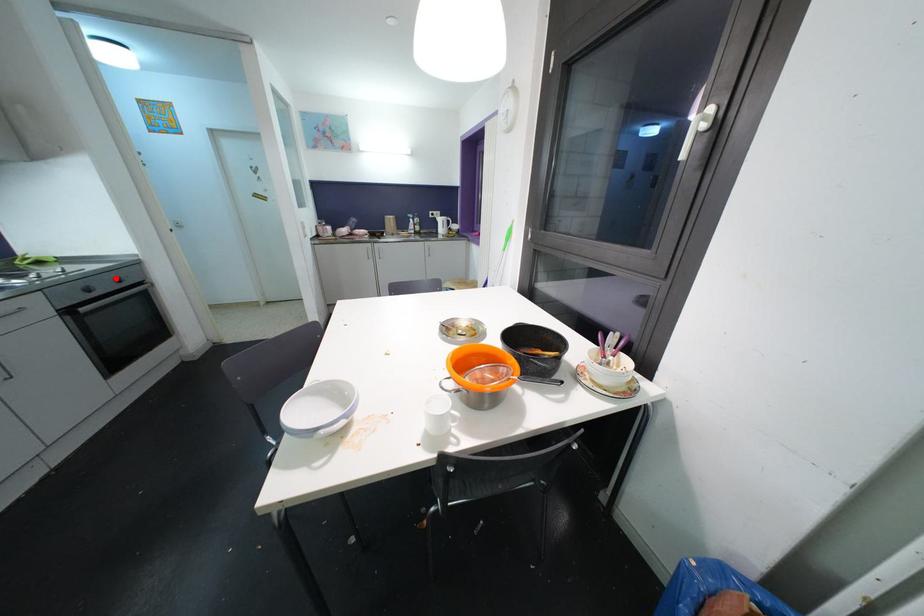
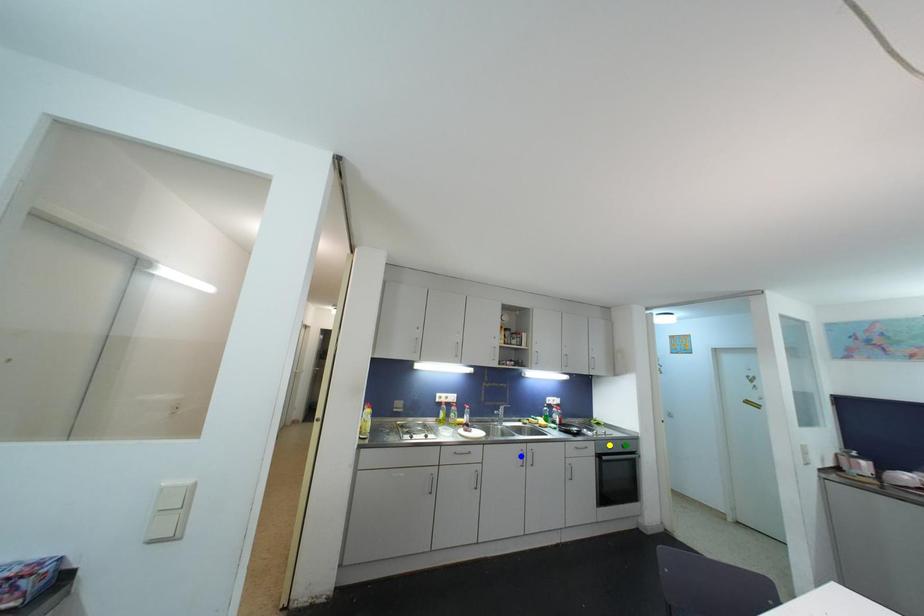
Question: I am providing you with two images of the same scene from different viewpoints. A red point is marked on the first image. You are given multiple points on the second image. In image 2, which mark is for the same physical point as the one in image 1?

Choices:
 (A) yellow point
 (B) blue point
 (C) green point

Answer: (C)